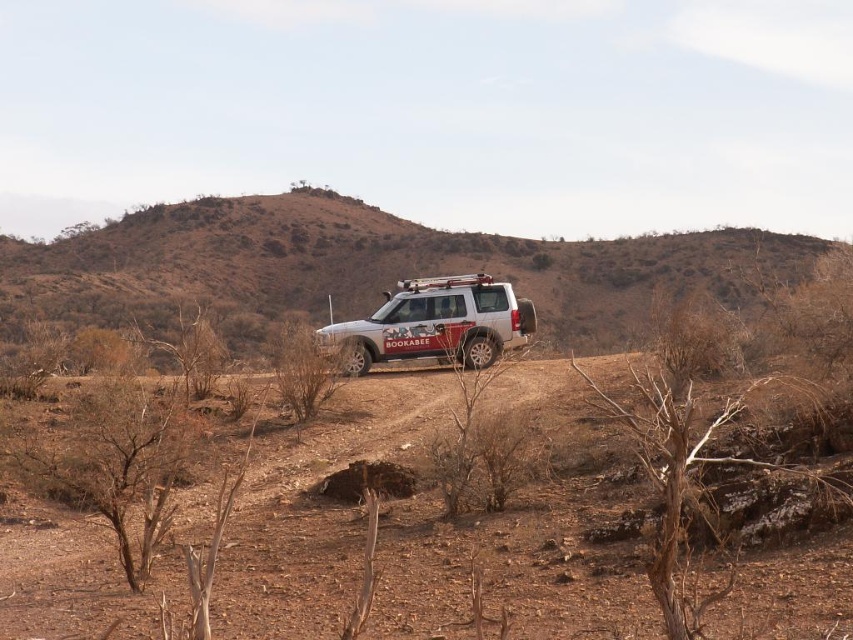
Describe the element at coordinates (376, 266) in the screenshot. I see `brown dirt hillside at center` at that location.

Consider the image. Between brown dirt hillside at center and white matte jeep at center, which one is positioned lower?

white matte jeep at center is lower down.

In order to click on brown dirt hillside at center in this screenshot , I will do `click(376, 266)`.

Is brown dry soil at center closer to the viewer compared to brown dirt hillside at center?

Yes, it is.

Between brown dry soil at center and brown dirt hillside at center, which one is positioned higher?

brown dirt hillside at center is above.

Is point (788, 605) closer to camera compared to point (642, 291)?

Yes, it is.

Locate an element on the screen. The width and height of the screenshot is (853, 640). brown dry soil at center is located at coordinates (509, 568).

Who is more distant from viewer, (296, 554) or (357, 348)?

Point (357, 348)

Find the location of a particular element. brown dry soil at center is located at coordinates (509, 568).